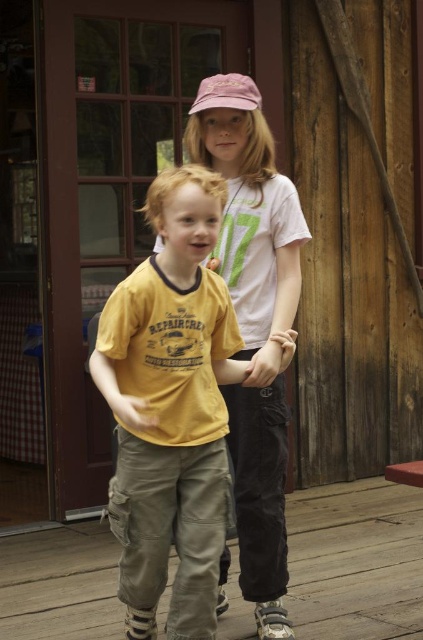
Can you confirm if wooden deck at center is bigger than pink fabric shirt at center?

No, wooden deck at center is not bigger than pink fabric shirt at center.

Is wooden deck at center to the right of pink fabric shirt at center from the viewer's perspective?

Yes, wooden deck at center is to the right of pink fabric shirt at center.

Describe the element at coordinates (356, 561) in the screenshot. The width and height of the screenshot is (423, 640). I see `wooden deck at center` at that location.

You are a GUI agent. You are given a task and a screenshot of the screen. Output one action in this format:
    pyautogui.click(x=<x>, y=<y>)
    Task: Click on the wooden deck at center
    
    Given the screenshot: What is the action you would take?
    pyautogui.click(x=356, y=561)

Is the position of yellow cotton t-shirt at center less distant than that of wooden deck at center?

Yes.

Who is more forward, (173, 509) or (368, 592)?

Positioned in front is point (173, 509).

Between point (112, 362) and point (365, 506), which one is positioned behind?

Positioned behind is point (365, 506).

This screenshot has height=640, width=423. In order to click on yellow cotton t-shirt at center in this screenshot , I will do pyautogui.click(x=170, y=408).

Does yellow cotton t-shirt at center have a greater width compared to pink fabric shirt at center?

Indeed, yellow cotton t-shirt at center has a greater width compared to pink fabric shirt at center.

In order to click on yellow cotton t-shirt at center in this screenshot , I will do `click(170, 408)`.